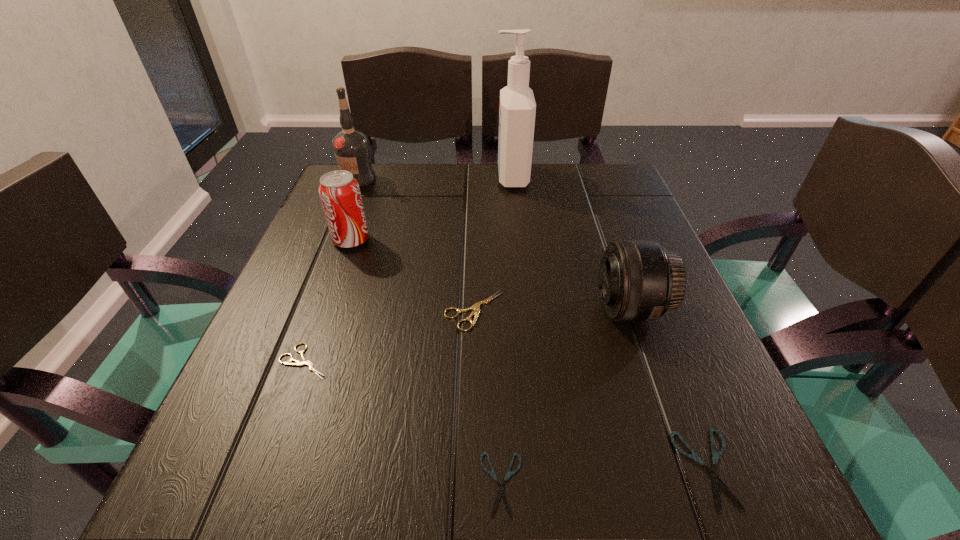
Where is `object that is the fifth closest to the telephoto lens`? object that is the fifth closest to the telephoto lens is located at coordinates (305, 361).

Identify which object is the nearest to the bigger beige shears. Please provide its 2D coordinates. Your answer should be formatted as a tuple, i.e. [(x, y)], where the tuple contains the x and y coordinates of a point satisfying the conditions above.

[(639, 280)]

Select which shears appears as the second closest to the third nearest shears. Please provide its 2D coordinates. Your answer should be formatted as a tuple, i.e. [(x, y)], where the tuple contains the x and y coordinates of a point satisfying the conditions above.

[(500, 493)]

Where is `the closest shears to the tallest object`? The width and height of the screenshot is (960, 540). the closest shears to the tallest object is located at coordinates (475, 307).

Locate an element on the screen. The height and width of the screenshot is (540, 960). vacant space that satisfies the following two spatial constraints: 1. on the front side of the third nearest object; 2. on the right side of the shortest shears is located at coordinates (260, 484).

Image resolution: width=960 pixels, height=540 pixels. In order to click on vacant region that satisfies the following two spatial constraints: 1. on the logo side of the red soda can; 2. on the left side of the shortest object in this screenshot , I will do `click(264, 484)`.

Where is `blank space that satisfies the following two spatial constraints: 1. on the front label of the right black shears; 2. on the left side of the seventh shortest object`? blank space that satisfies the following two spatial constraints: 1. on the front label of the right black shears; 2. on the left side of the seventh shortest object is located at coordinates (240, 469).

Locate an element on the screen. The height and width of the screenshot is (540, 960). vacant region that satisfies the following two spatial constraints: 1. on the logo side of the smaller black shears; 2. on the right side of the sixth nearest object is located at coordinates (264, 484).